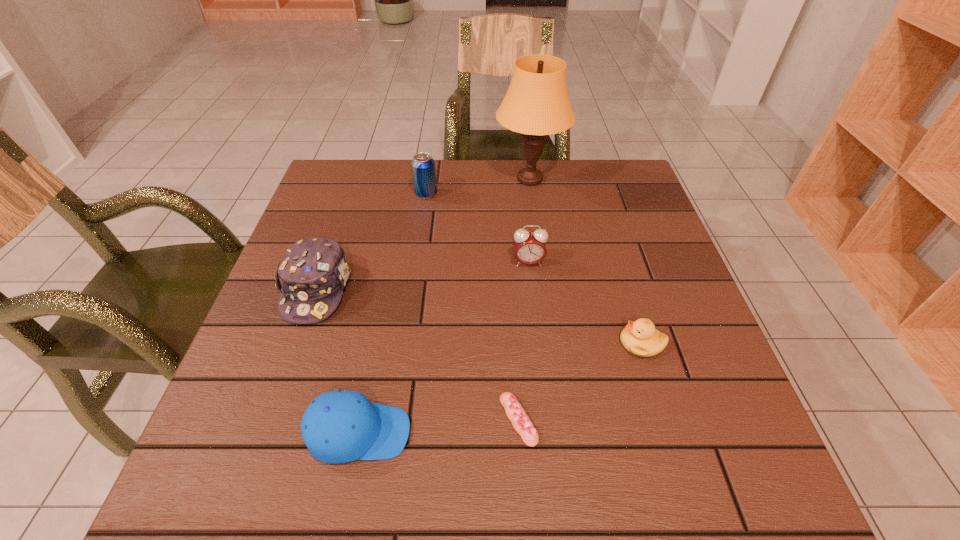
What are the coordinates of `vacant space at the near right corner of the desktop` in the screenshot? It's located at (675, 465).

Find the location of a particular element. free point between the third shortest object and the alarm clock is located at coordinates (444, 348).

You are a GUI agent. You are given a task and a screenshot of the screen. Output one action in this format:
    pyautogui.click(x=<x>, y=<y>)
    Task: Click on the unoccupied area between the farther cap and the shortest object
    Image resolution: width=960 pixels, height=540 pixels.
    Given the screenshot: What is the action you would take?
    pyautogui.click(x=418, y=354)

The height and width of the screenshot is (540, 960). Find the location of `vacant region between the tallest object and the third shortest object`. vacant region between the tallest object and the third shortest object is located at coordinates (444, 306).

Locate an element on the screen. The height and width of the screenshot is (540, 960). free space that is in between the alarm clock and the shortest object is located at coordinates click(x=523, y=341).

The width and height of the screenshot is (960, 540). What are the coordinates of `free spot between the alarm clock and the nearer cap` in the screenshot? It's located at (444, 348).

Identify the location of vacant point located between the beer can and the lampshade. (478, 187).

The height and width of the screenshot is (540, 960). Identify the location of empty space that is in between the farther cap and the third shortest object. (338, 361).

At what (x,y) coordinates should I click in order to perform the action: click on vacant region between the farther cap and the shortest object. Please return your answer as a coordinate pair (x, y). Looking at the image, I should click on (418, 354).

Where is `free space between the alarm clock and the duckling`? The height and width of the screenshot is (540, 960). free space between the alarm clock and the duckling is located at coordinates (585, 303).